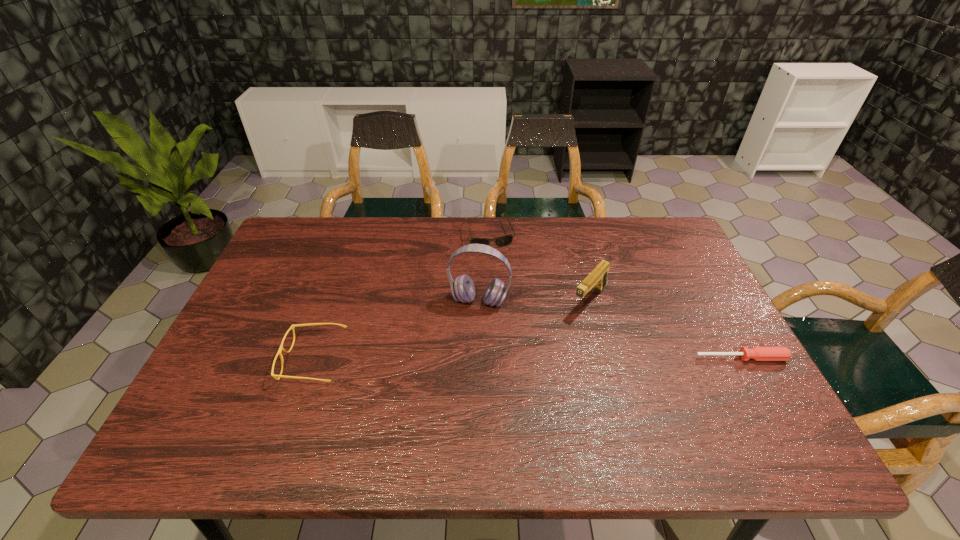
Image resolution: width=960 pixels, height=540 pixels. Find the location of `free spot located 0.160m at the barrel of the fourth object from left to right`. free spot located 0.160m at the barrel of the fourth object from left to right is located at coordinates (548, 351).

Locate an element on the screen. The image size is (960, 540). vacant region located 0.350m at the barrel of the fourth object from left to right is located at coordinates (503, 403).

The height and width of the screenshot is (540, 960). Find the location of `vacant area situated at the barrel of the fourth object from left to right`. vacant area situated at the barrel of the fourth object from left to right is located at coordinates (552, 346).

At what (x,y) coordinates should I click in order to perform the action: click on free location located 0.120m on the lenses of the sunglasses. Please return your answer as a coordinate pair (x, y). The width and height of the screenshot is (960, 540). Looking at the image, I should click on (501, 274).

Locate an element on the screen. Image resolution: width=960 pixels, height=540 pixels. free space located 0.320m on the lenses of the sunglasses is located at coordinates (516, 323).

Identify the location of free region located 0.190m on the lenses of the sunglasses. (506, 289).

Locate an element on the screen. The image size is (960, 540). free point located 0.310m on the headband and ear cups of the headset is located at coordinates (448, 414).

Where is `free spot located 0.090m on the headband and ear cups of the headset`? The height and width of the screenshot is (540, 960). free spot located 0.090m on the headband and ear cups of the headset is located at coordinates (468, 338).

This screenshot has height=540, width=960. Find the location of `free space located on the headband and ear cups of the headset`. free space located on the headband and ear cups of the headset is located at coordinates (454, 390).

At what (x,y) coordinates should I click in order to perform the action: click on object that is positioned at the far edge. Please return your answer as a coordinate pair (x, y). The image size is (960, 540). Looking at the image, I should click on (505, 240).